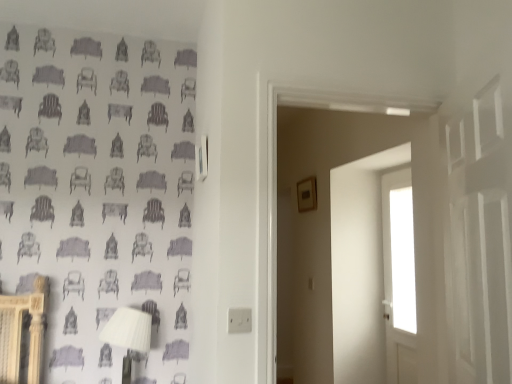
Question: Can you confirm if white plastic table lamp at lower left is taller than transparent glass window at upper right, which is counted as the first window, starting from the top?

Choices:
 (A) yes
 (B) no

Answer: (B)

Question: Is white plastic table lamp at lower left smaller than transparent glass window at upper right, which is counted as the 2th window, starting from the bottom?

Choices:
 (A) yes
 (B) no

Answer: (B)

Question: Is the depth of white plastic table lamp at lower left greater than that of transparent glass window at upper right, which is counted as the 2th window, starting from the bottom?

Choices:
 (A) no
 (B) yes

Answer: (A)

Question: From a real-world perspective, is white plastic table lamp at lower left physically above transparent glass window at upper right, which is counted as the first window, starting from the top?

Choices:
 (A) yes
 (B) no

Answer: (B)

Question: From a real-world perspective, does white plastic table lamp at lower left sit lower than transparent glass window at upper right, which is counted as the first window, starting from the top?

Choices:
 (A) no
 (B) yes

Answer: (B)

Question: Considering the positions of point (395, 203) and point (394, 213), is point (395, 203) closer or farther from the camera than point (394, 213)?

Choices:
 (A) farther
 (B) closer

Answer: (B)

Question: Choose the correct answer: Is transparent glass window at upper right, which is counted as the first window, starting from the top, inside transparent glass door at center, placed as the first window when sorted from bottom to top, or outside it?

Choices:
 (A) inside
 (B) outside

Answer: (A)

Question: Considering their positions, is transparent glass window at upper right, which is counted as the 2th window, starting from the bottom, located in front of or behind transparent glass door at center, the second window from the top?

Choices:
 (A) front
 (B) behind

Answer: (B)

Question: In terms of height, does transparent glass window at upper right, which is counted as the 2th window, starting from the bottom, look taller or shorter compared to transparent glass door at center, placed as the first window when sorted from bottom to top?

Choices:
 (A) tall
 (B) short

Answer: (B)

Question: Would you say transparent glass door at center, the second window from the top, is inside or outside white plastic table lamp at lower left?

Choices:
 (A) inside
 (B) outside

Answer: (B)

Question: Considering the relative positions of transparent glass door at center, the second window from the top, and white plastic table lamp at lower left in the image provided, is transparent glass door at center, the second window from the top, to the left or to the right of white plastic table lamp at lower left?

Choices:
 (A) right
 (B) left

Answer: (A)

Question: In terms of width, does transparent glass door at center, placed as the first window when sorted from bottom to top, look wider or thinner when compared to white plastic table lamp at lower left?

Choices:
 (A) wide
 (B) thin

Answer: (B)

Question: Is transparent glass door at center, the second window from the top, in front of or behind white plastic table lamp at lower left in the image?

Choices:
 (A) front
 (B) behind

Answer: (B)

Question: In the image, is transparent glass window at upper right, which is counted as the first window, starting from the top, positioned in front of or behind white plastic table lamp at lower left?

Choices:
 (A) behind
 (B) front

Answer: (A)

Question: From a real-world perspective, is transparent glass window at upper right, which is counted as the 2th window, starting from the bottom, above or below white plastic table lamp at lower left?

Choices:
 (A) below
 (B) above

Answer: (B)